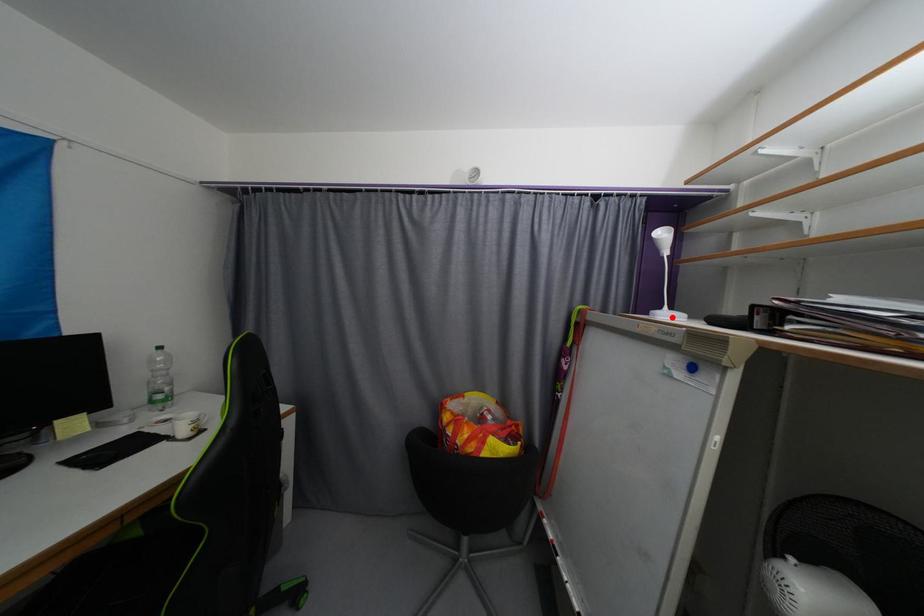
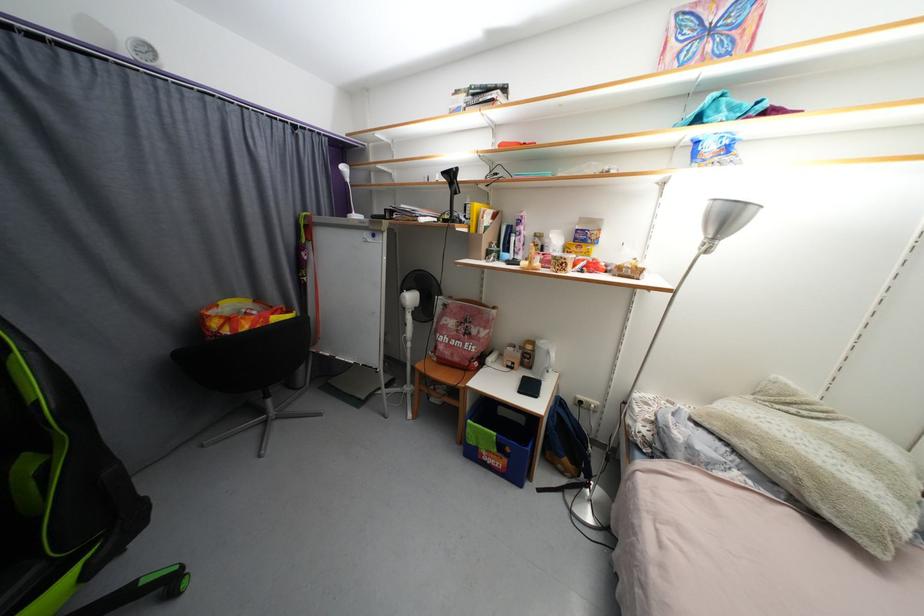
Question: I am providing you with two images of the same scene from different viewpoints. Given a red point in image1, look at the same physical point in image2. Is it:

Choices:
 (A) Closer to the viewpoint
 (B) Farther from the viewpoint

Answer: (A)